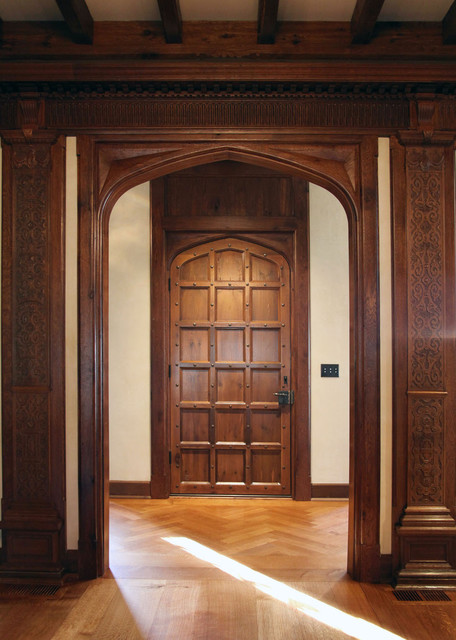
Where is `handle`? This screenshot has width=456, height=640. handle is located at coordinates (284, 395).